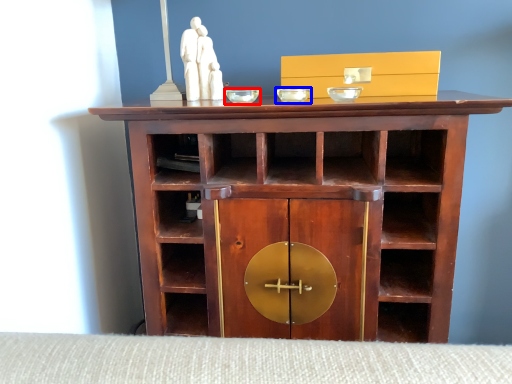
Question: Which object is further to the camera taking this photo, glass bowl (highlighted by a red box) or glass bowl (highlighted by a blue box)?

Choices:
 (A) glass bowl
 (B) glass bowl

Answer: (A)